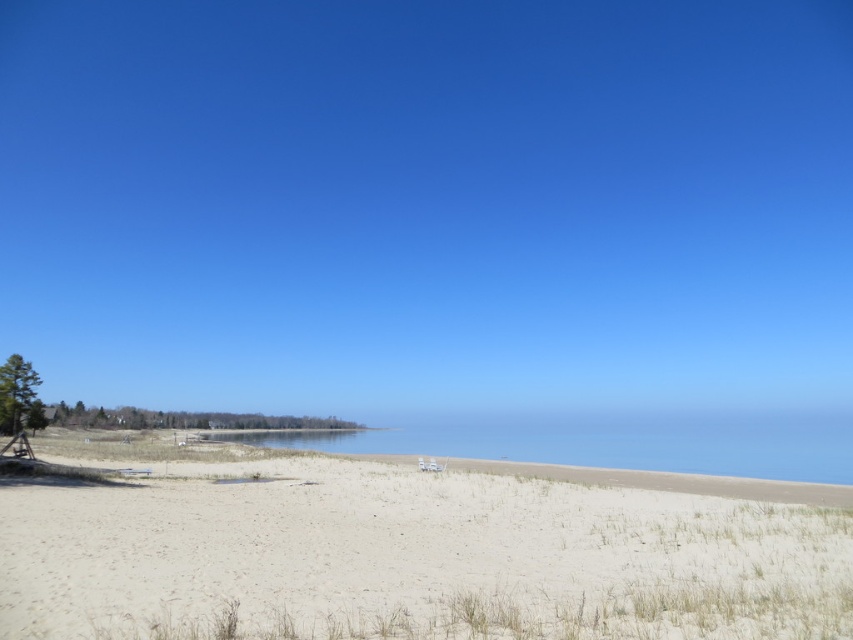
Can you confirm if white sandy beach at lower left is taller than blue water at center?

Incorrect, white sandy beach at lower left's height is not larger of blue water at center's.

The height and width of the screenshot is (640, 853). In order to click on white sandy beach at lower left in this screenshot , I will do `click(413, 560)`.

Identify the location of white sandy beach at lower left. This screenshot has height=640, width=853. (413, 560).